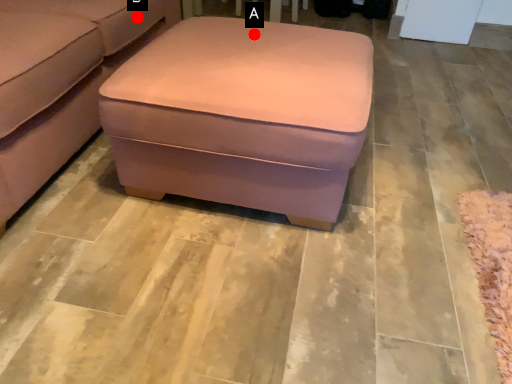
Question: Two points are circled on the image, labeled by A and B beside each circle. Which of the following is the closest to the observer?

Choices:
 (A) A is closer
 (B) B is closer

Answer: (A)